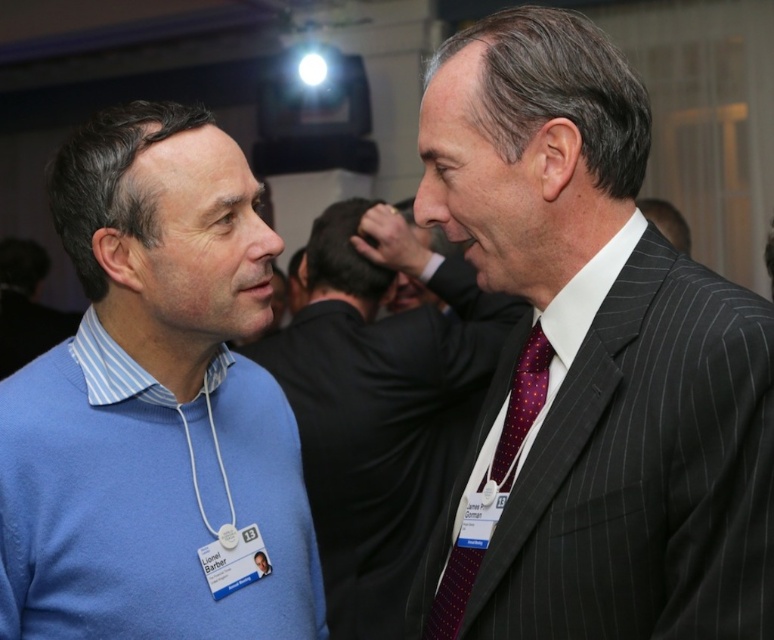
Question: Does matte black suit at center come in front of purple dotted silk tie at center?

Choices:
 (A) yes
 (B) no

Answer: (B)

Question: Which object is the farthest from the purple dotted silk tie at center?

Choices:
 (A) matte black suit at center
 (B) blue sweater at center

Answer: (A)

Question: Is dark gray pinstripe suit at center to the right of purple dotted silk tie at center from the viewer's perspective?

Choices:
 (A) no
 (B) yes

Answer: (B)

Question: Which object is the farthest from the matte black suit at center?

Choices:
 (A) purple dotted silk tie at center
 (B) dark gray pinstripe suit at center

Answer: (A)

Question: Can you confirm if blue sweater at center is bigger than matte black suit at center?

Choices:
 (A) no
 (B) yes

Answer: (A)

Question: Which of these objects is positioned farthest from the purple dotted silk tie at center?

Choices:
 (A) blue sweater at center
 (B) matte black suit at center
 (C) dark gray pinstripe suit at center

Answer: (B)